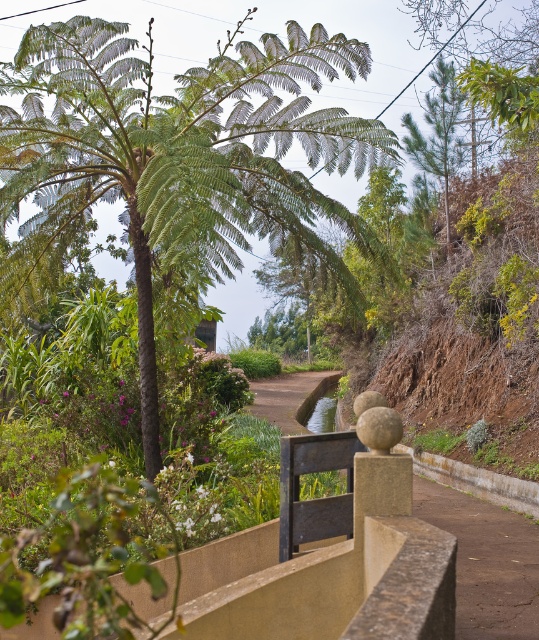
Question: Which object is farther from the camera taking this photo?

Choices:
 (A) green leafy palm tree at center
 (B) brown dirt path at center

Answer: (B)

Question: Does green leafy palm tree at center come in front of brown dirt path at center?

Choices:
 (A) no
 (B) yes

Answer: (B)

Question: Does green leafy palm tree at center have a lesser width compared to brown dirt path at center?

Choices:
 (A) no
 (B) yes

Answer: (A)

Question: Which of the following is the closest to the observer?

Choices:
 (A) brown dirt path at center
 (B) green leafy palm tree at center

Answer: (B)

Question: Is green leafy palm tree at center below brown dirt path at center?

Choices:
 (A) no
 (B) yes

Answer: (A)

Question: Which object appears farthest from the camera in this image?

Choices:
 (A) green leafy palm tree at center
 (B) brown dirt path at center

Answer: (B)